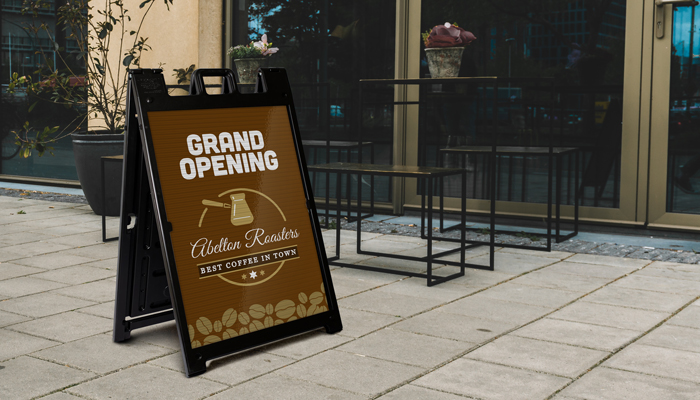
The width and height of the screenshot is (700, 400). Find the location of `window doorway`. window doorway is located at coordinates (600, 90).